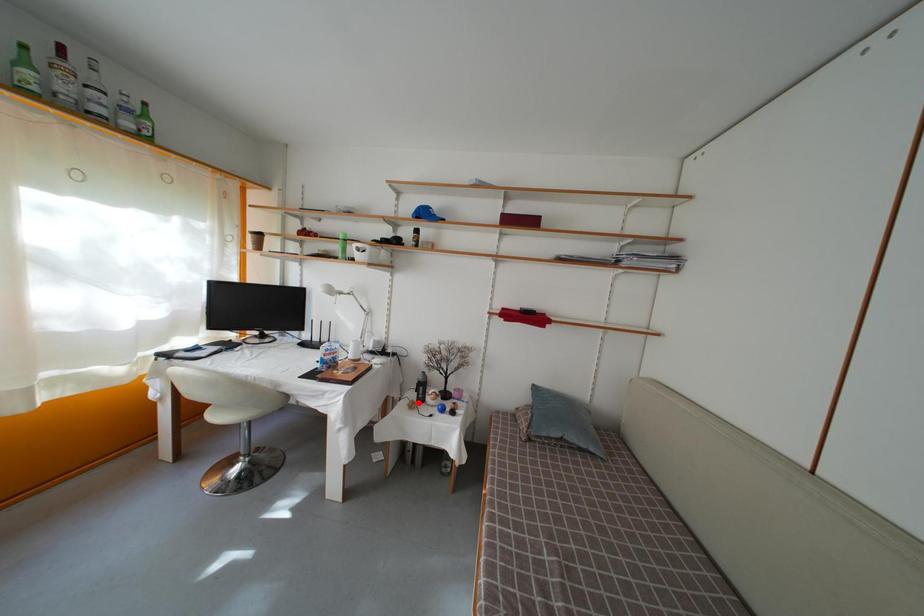
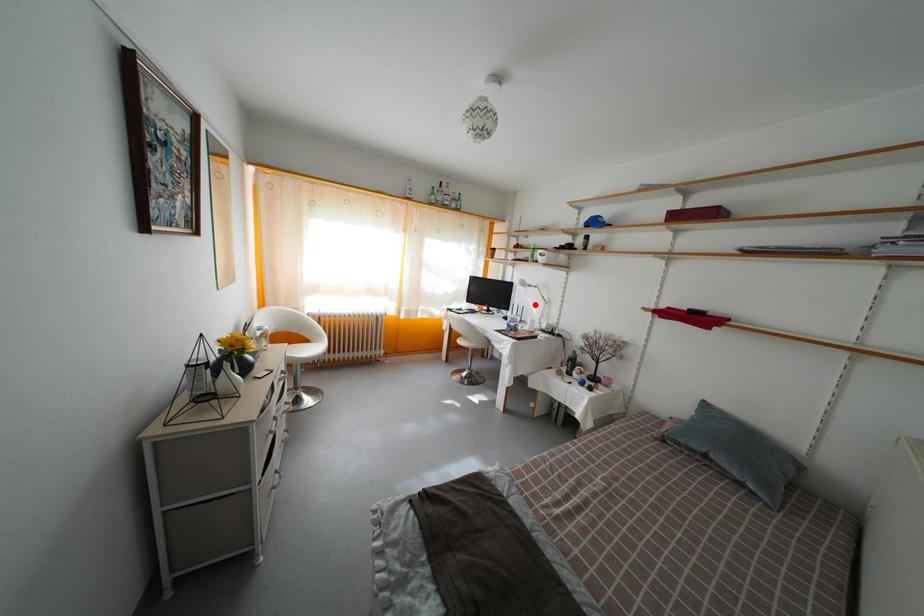
I am providing you with two images of the same scene from different viewpoints. A red point is marked on the first image and another point is marked on the second image. Does the point marked in image1 correspond to the same location as the one in image2?

No